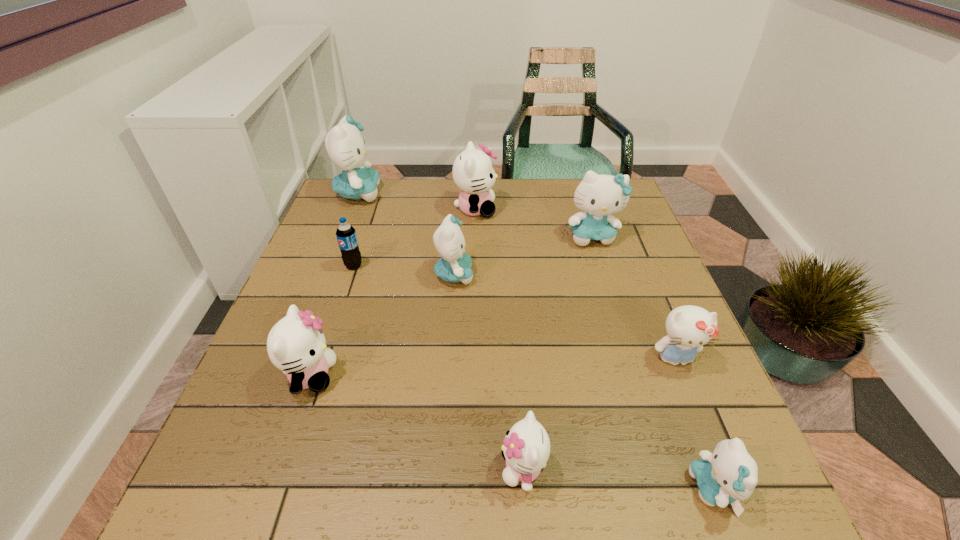
I want to click on vacant space that is in between the tallest kitten and the soda bottle, so click(x=356, y=230).

You are a GUI agent. You are given a task and a screenshot of the screen. Output one action in this format:
    pyautogui.click(x=<x>, y=<y>)
    Task: Click on the vacant point located between the soda bottle and the biggest white kitten
    This screenshot has width=960, height=540.
    Given the screenshot: What is the action you would take?
    pyautogui.click(x=415, y=238)

The width and height of the screenshot is (960, 540). Find the location of `the closest object to the nearest white kitten`. the closest object to the nearest white kitten is located at coordinates (729, 475).

Locate an element on the screen. This screenshot has height=540, width=960. object that is the fifth nearest to the nearest blue kitten is located at coordinates coord(296,344).

Find the location of a particular element. The width and height of the screenshot is (960, 540). kitten that stands as the fourth closest to the nearest blue kitten is located at coordinates (598, 195).

Locate which kitten ranks in proximity to the biggest blue kitten. Please provide its 2D coordinates. Your answer should be formatted as a tuple, i.e. [(x, y)], where the tuple contains the x and y coordinates of a point satisfying the conditions above.

[(473, 173)]

Find the location of a particular element. Image resolution: width=960 pixels, height=540 pixels. blue kitten that stands as the third closest to the third smallest blue kitten is located at coordinates (729, 475).

Identify which blue kitten is the second nearest to the fourth farthest kitten. Please provide its 2D coordinates. Your answer should be formatted as a tuple, i.e. [(x, y)], where the tuple contains the x and y coordinates of a point satisfying the conditions above.

[(346, 148)]

I want to click on white kitten that stands as the second closest to the third biggest blue kitten, so click(296, 344).

Choose which white kitten is the nearest neighbor to the third blue kitten from right to left. Please provide its 2D coordinates. Your answer should be formatted as a tuple, i.e. [(x, y)], where the tuple contains the x and y coordinates of a point satisfying the conditions above.

[(473, 173)]